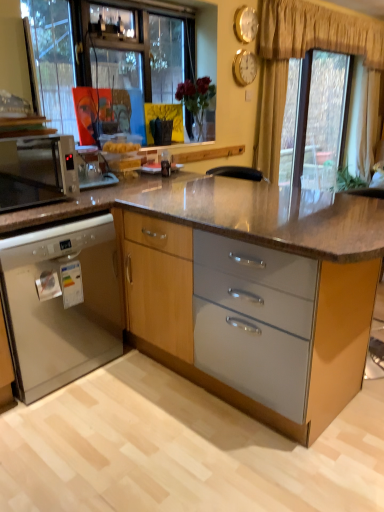
Question: Is matte wood cabinet at center, the 2th cabinetry from the left, not near satin black microwave at left?

Choices:
 (A) no
 (B) yes

Answer: (A)

Question: Is matte wood cabinet at center, the 2th cabinetry from the left, turned away from satin black microwave at left?

Choices:
 (A) no
 (B) yes

Answer: (A)

Question: Can you confirm if matte wood cabinet at center, the 2th cabinetry from the left, is positioned to the right of satin black microwave at left?

Choices:
 (A) no
 (B) yes

Answer: (B)

Question: Is matte wood cabinet at center, the 1th cabinetry in the right-to-left sequence, shorter than satin black microwave at left?

Choices:
 (A) yes
 (B) no

Answer: (B)

Question: Does matte wood cabinet at center, the 2th cabinetry from the left, touch satin black microwave at left?

Choices:
 (A) no
 (B) yes

Answer: (A)

Question: From the image's perspective, is gold metallic clock at upper center, the first clock positioned from the top, positioned above or below transparent glass window at upper right?

Choices:
 (A) above
 (B) below

Answer: (A)

Question: From a real-world perspective, relative to transparent glass window at upper right, is gold metallic clock at upper center, the first clock positioned from the top, vertically above or below?

Choices:
 (A) above
 (B) below

Answer: (A)

Question: Considering the relative positions of gold metallic clock at upper center, arranged as the 2th clock when ordered from the bottom, and transparent glass window at upper right in the image provided, is gold metallic clock at upper center, arranged as the 2th clock when ordered from the bottom, to the left or to the right of transparent glass window at upper right?

Choices:
 (A) left
 (B) right

Answer: (A)

Question: Is gold metallic clock at upper center, arranged as the 2th clock when ordered from the bottom, taller or shorter than transparent glass window at upper right?

Choices:
 (A) tall
 (B) short

Answer: (B)

Question: Does point (254, 61) appear closer or farther from the camera than point (244, 20)?

Choices:
 (A) farther
 (B) closer

Answer: (A)

Question: In the image, is gold metallic clock at upper center, which ranks as the first clock in bottom-to-top order, positioned in front of or behind gold metallic clock at upper center, arranged as the 2th clock when ordered from the bottom?

Choices:
 (A) front
 (B) behind

Answer: (B)

Question: In terms of width, does gold metallic clock at upper center, which ranks as the first clock in bottom-to-top order, look wider or thinner when compared to gold metallic clock at upper center, the first clock positioned from the top?

Choices:
 (A) wide
 (B) thin

Answer: (B)

Question: In terms of height, does gold metallic clock at upper center, which ranks as the first clock in bottom-to-top order, look taller or shorter compared to gold metallic clock at upper center, arranged as the 2th clock when ordered from the bottom?

Choices:
 (A) short
 (B) tall

Answer: (B)

Question: Is gold textured curtain at upper center wider or thinner than matte wood cabinet at center, the 1th cabinetry in the right-to-left sequence?

Choices:
 (A) wide
 (B) thin

Answer: (B)

Question: In terms of size, does gold textured curtain at upper center appear bigger or smaller than matte wood cabinet at center, the 2th cabinetry from the left?

Choices:
 (A) big
 (B) small

Answer: (B)